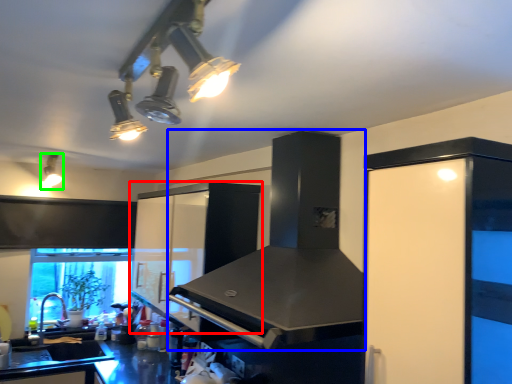
Question: Based on their relative distances, which object is farther from cabinetry (highlighted by a red box)? Choose from vent (highlighted by a blue box) and light fixture (highlighted by a green box).

Choices:
 (A) vent
 (B) light fixture

Answer: (B)